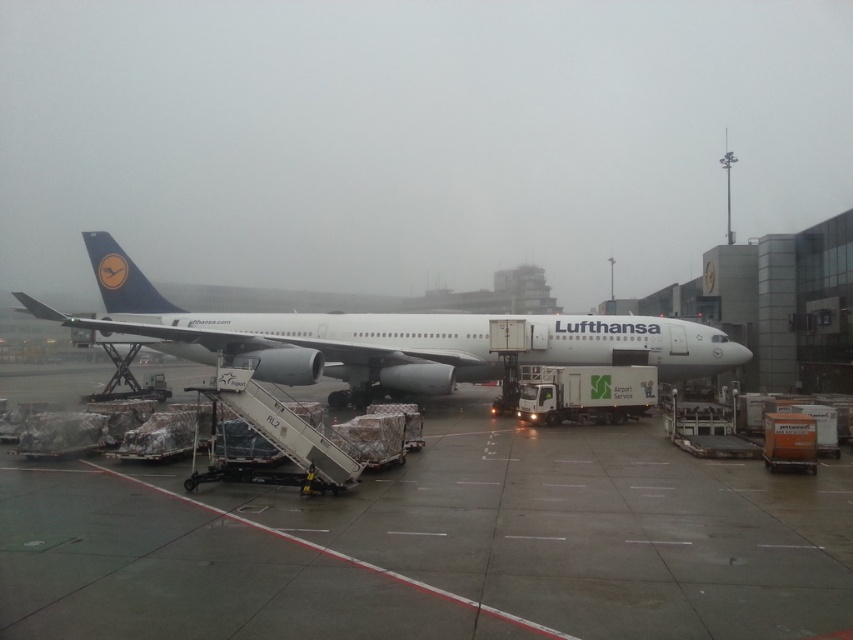
Question: Among these objects, which one is farthest from the camera?

Choices:
 (A) white metallic airplane at center
 (B) concrete tarmac at center

Answer: (A)

Question: Observing the image, what is the correct spatial positioning of concrete tarmac at center in reference to white metallic airplane at center?

Choices:
 (A) right
 (B) left

Answer: (A)

Question: Is concrete tarmac at center to the right of white metallic airplane at center from the viewer's perspective?

Choices:
 (A) no
 (B) yes

Answer: (B)

Question: Among these objects, which one is nearest to the camera?

Choices:
 (A) white metallic airplane at center
 (B) concrete tarmac at center

Answer: (B)

Question: Can you confirm if concrete tarmac at center is smaller than white metallic airplane at center?

Choices:
 (A) no
 (B) yes

Answer: (B)